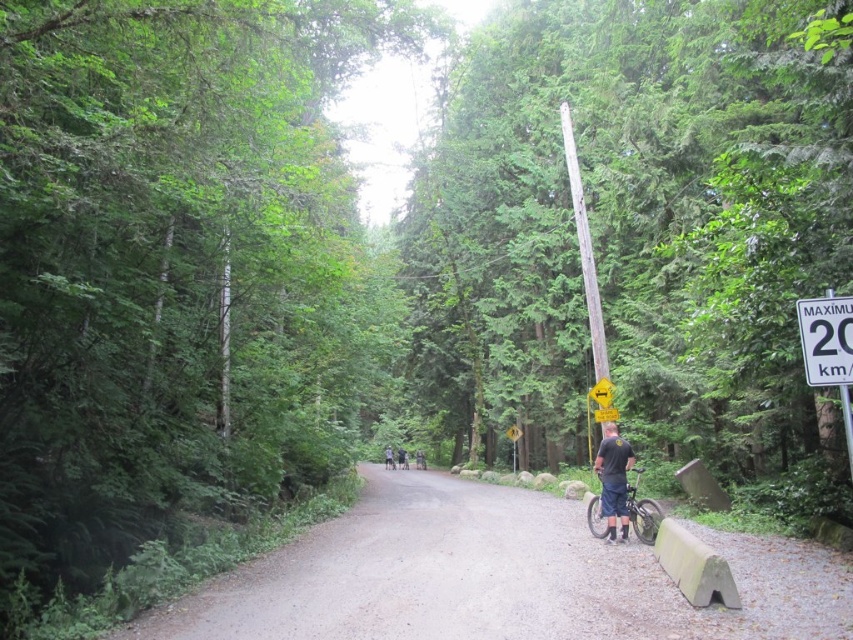
You are standing at the center of the road in the forest scene. There is a point marked at coordinates (639, 234). Which object does this point belong to?

The point at (639, 234) is located on the smooth wooden pole at right.

You are a hiker who wants to take a photo of the smooth wooden pole at right and the shiny metallic bicycle at lower right. Which object should you focus on first if you want to capture both in one frame without moving the camera?

The smooth wooden pole at right is taller than the shiny metallic bicycle at lower right, so you should focus on the smooth wooden pole at right first to ensure both are in frame.

You are a hiker who wants to take a photo of the light blue jeans at center and the shiny metallic bicycle at lower right. Where should you position yourself relative to both objects to capture both in the frame?

You should position yourself to the left of both the light blue jeans at center and the shiny metallic bicycle at lower right so that the bicycle, which is to the right of the jeans, fits into the frame.